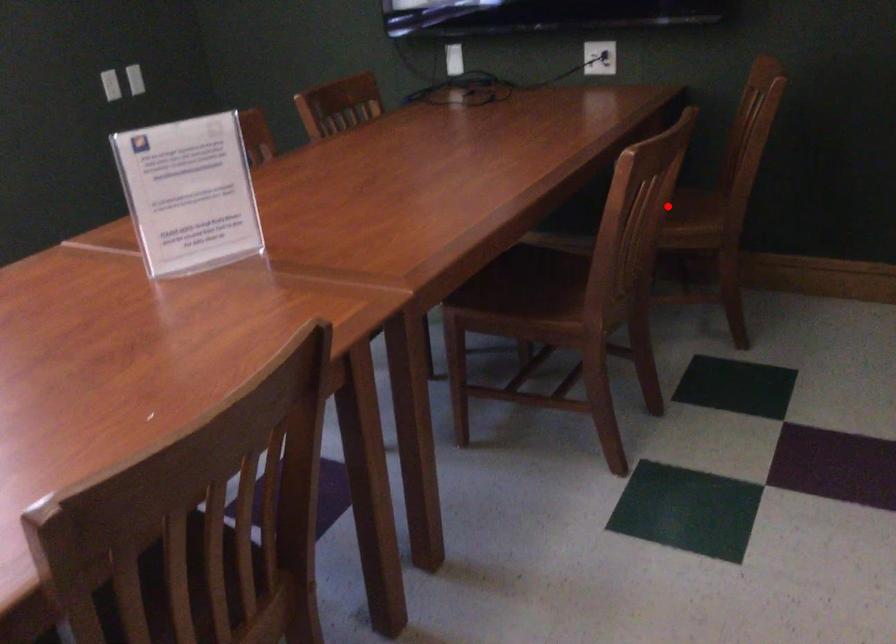
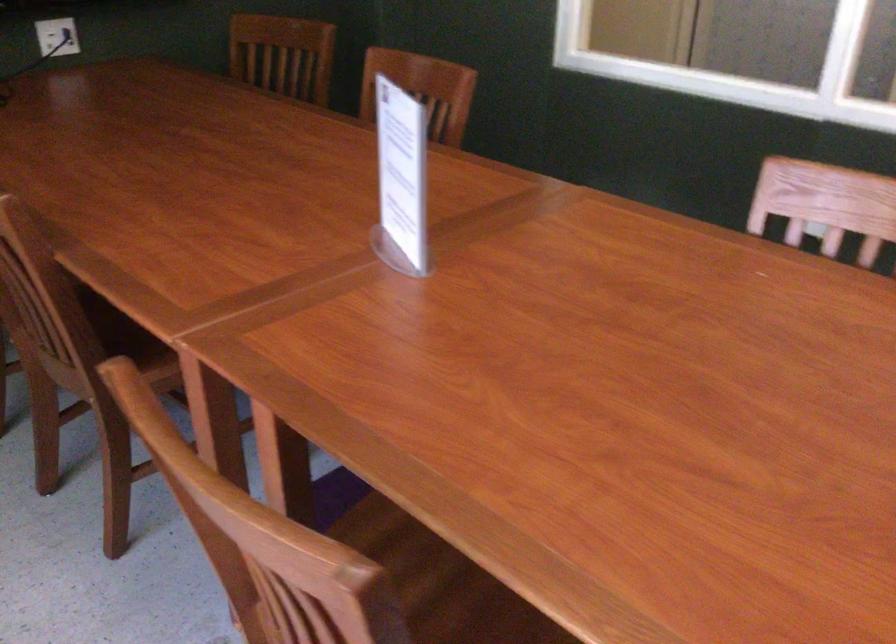
Question: I am providing you with two images of the same scene from different viewpoints. A red point is marked on the first image. Is the red point's position out of view in image 2?

Choices:
 (A) Yes
 (B) No

Answer: (A)